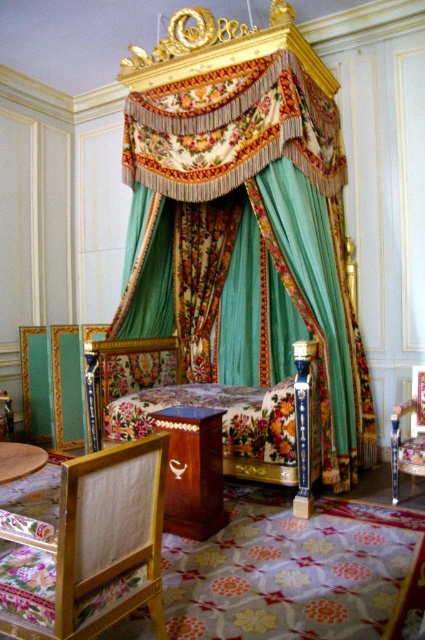
Question: Is wooden chair at lower left wider than wooden table at lower center?

Choices:
 (A) yes
 (B) no

Answer: (A)

Question: Which point appears farthest from the camera in this image?

Choices:
 (A) (184, 408)
 (B) (90, 586)

Answer: (A)

Question: Does velvet floral bed at center appear on the right side of wooden table at lower left?

Choices:
 (A) no
 (B) yes

Answer: (B)

Question: Which object appears farthest from the camera in this image?

Choices:
 (A) wooden table at lower center
 (B) floral fabric canopy bed at center
 (C) wooden table at lower left
 (D) velvet floral bed at center

Answer: (B)

Question: Is wooden chair at lower left wider than velvet floral bed at center?

Choices:
 (A) no
 (B) yes

Answer: (A)

Question: Considering the real-world distances, which object is farthest from the wooden chair at lower left?

Choices:
 (A) wooden polished chair at lower right
 (B) velvet floral bed at center
 (C) wooden table at lower left

Answer: (A)